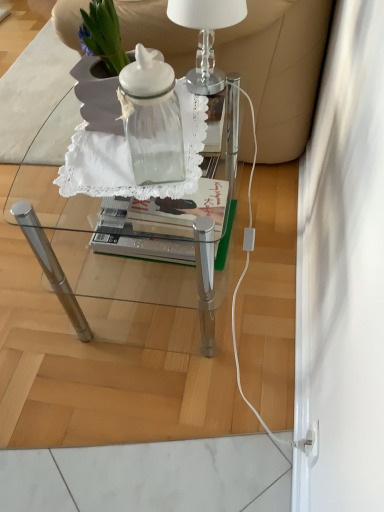
This screenshot has height=512, width=384. In order to click on white leather armchair at upper center in this screenshot , I will do `click(278, 69)`.

Identify the location of transparent glass table at center. pos(133,242).

What do you see at coordinates (133, 242) in the screenshot? The height and width of the screenshot is (512, 384). I see `transparent glass table at center` at bounding box center [133, 242].

The height and width of the screenshot is (512, 384). I want to click on transparent glass jar at center, so click(152, 120).

Find the location of a particular element. This screenshot has width=384, height=512. white leather armchair at upper center is located at coordinates (278, 69).

Who is taller, clear glass table lamp at upper center or transparent glass table at center?

transparent glass table at center is taller.

Is clear glass table lamp at upper center beside transparent glass table at center?

clear glass table lamp at upper center is not next to transparent glass table at center, and they're not touching.

Choose the correct answer: Is clear glass table lamp at upper center inside transparent glass table at center or outside it?

clear glass table lamp at upper center exists outside the volume of transparent glass table at center.

From the image's perspective, is clear glass table lamp at upper center above or below transparent glass table at center?

Based on their image positions, clear glass table lamp at upper center is located above transparent glass table at center.

Is clear glass table lamp at upper center aimed at white leather armchair at upper center?

No, clear glass table lamp at upper center does not turn towards white leather armchair at upper center.

From the image's perspective, is clear glass table lamp at upper center located beneath white leather armchair at upper center?

Yes, from the image's perspective, clear glass table lamp at upper center is beneath white leather armchair at upper center.

Is clear glass table lamp at upper center with white leather armchair at upper center?

No, clear glass table lamp at upper center is not with white leather armchair at upper center.

From a real-world perspective, is clear glass table lamp at upper center under white leather armchair at upper center?

No, from a real-world perspective, clear glass table lamp at upper center is not beneath white leather armchair at upper center.

Is transparent glass jar at center next to transparent glass table at center and touching it?

No.

Looking at this image, from a real-world perspective, is transparent glass jar at center above or below transparent glass table at center?

transparent glass jar at center is situated higher than transparent glass table at center in the real world.

Is transparent glass jar at center inside or outside of transparent glass table at center?

transparent glass jar at center is not inside transparent glass table at center, it's outside.

From the image's perspective, between transparent glass jar at center and clear glass table lamp at upper center, who is located below?

transparent glass jar at center appears lower in the image.

How different are the orientations of transparent glass jar at center and clear glass table lamp at upper center in degrees?

The angle between the facing direction of transparent glass jar at center and the facing direction of clear glass table lamp at upper center is 13.1 degrees.

This screenshot has height=512, width=384. I want to click on bottle that is below the clear glass table lamp at upper center (from the image's perspective), so click(x=152, y=120).

Would you say transparent glass jar at center is a long distance from clear glass table lamp at upper center?

transparent glass jar at center is near clear glass table lamp at upper center, not far away.

Does white leather armchair at upper center appear on the right side of transparent glass jar at center?

No, white leather armchair at upper center is not to the right of transparent glass jar at center.

From the image's perspective, is white leather armchair at upper center on top of transparent glass jar at center?

Yes.

Locate an element on the screen. Image resolution: width=384 pixels, height=512 pixels. armchair above the transparent glass jar at center (from the image's perspective) is located at coordinates (278, 69).

From a real-world perspective, is white leather armchair at upper center under transparent glass jar at center?

Indeed, from a real-world perspective, white leather armchair at upper center is positioned beneath transparent glass jar at center.

Identify the location of table in front of the clear glass table lamp at upper center. (133, 242).

How different are the orientations of transparent glass table at center and clear glass table lamp at upper center in degrees?

The angle between the facing direction of transparent glass table at center and the facing direction of clear glass table lamp at upper center is 0.782 degrees.

From the picture: Does transparent glass table at center turn towards clear glass table lamp at upper center?

No, transparent glass table at center is not oriented towards clear glass table lamp at upper center.

From a real-world perspective, is transparent glass table at center positioned above or below clear glass table lamp at upper center?

transparent glass table at center is situated lower than clear glass table lamp at upper center in the real world.

Is white leather armchair at upper center next to clear glass table lamp at upper center?

No, white leather armchair at upper center is not next to clear glass table lamp at upper center.

Is white leather armchair at upper center bigger or smaller than clear glass table lamp at upper center?

In the image, white leather armchair at upper center appears to be larger than clear glass table lamp at upper center.

Could you tell me if white leather armchair at upper center is turned towards clear glass table lamp at upper center?

No, white leather armchair at upper center does not turn towards clear glass table lamp at upper center.

From the image's perspective, is white leather armchair at upper center positioned above or below clear glass table lamp at upper center?

white leather armchair at upper center is situated higher than clear glass table lamp at upper center in the image.

Where is `table below the clear glass table lamp at upper center (from the image's perspective)`? Image resolution: width=384 pixels, height=512 pixels. table below the clear glass table lamp at upper center (from the image's perspective) is located at coordinates (133, 242).

This screenshot has height=512, width=384. Identify the location of table lamp on the right side of white leather armchair at upper center. (206, 37).

Estimate the real-world distances between objects in this image. Which object is further from transparent glass table at center, clear glass table lamp at upper center or white leather armchair at upper center?

Based on the image, white leather armchair at upper center appears to be further to transparent glass table at center.

Which object lies nearer to the anchor point white leather armchair at upper center, transparent glass table at center or transparent glass jar at center?

Among the two, transparent glass jar at center is located nearer to white leather armchair at upper center.

Considering their positions, is clear glass table lamp at upper center positioned further to transparent glass jar at center than white leather armchair at upper center?

white leather armchair at upper center lies further to transparent glass jar at center than the other object.

Estimate the real-world distances between objects in this image. Which object is further from clear glass table lamp at upper center, white leather armchair at upper center or transparent glass table at center?

transparent glass table at center is positioned further to the anchor clear glass table lamp at upper center.

Looking at the image, which one is located further to transparent glass table at center, white leather armchair at upper center or clear glass table lamp at upper center?

white leather armchair at upper center is further to transparent glass table at center.

From the image, which object appears to be nearer to clear glass table lamp at upper center, transparent glass table at center or white leather armchair at upper center?

white leather armchair at upper center is closer to clear glass table lamp at upper center.

Considering their positions, is clear glass table lamp at upper center positioned closer to transparent glass jar at center than transparent glass table at center?

clear glass table lamp at upper center is closer to transparent glass jar at center.

From the image, which object appears to be farther from white leather armchair at upper center, clear glass table lamp at upper center or transparent glass table at center?

Among the two, transparent glass table at center is located further to white leather armchair at upper center.

What are the coordinates of `bottle between clear glass table lamp at upper center and transparent glass table at center in the vertical direction` in the screenshot? It's located at (152, 120).

Image resolution: width=384 pixels, height=512 pixels. Identify the location of table lamp between white leather armchair at upper center and transparent glass jar at center from top to bottom. (206, 37).

Image resolution: width=384 pixels, height=512 pixels. Find the location of `table lamp between white leather armchair at upper center and transparent glass table at center in the vertical direction`. table lamp between white leather armchair at upper center and transparent glass table at center in the vertical direction is located at coordinates (206, 37).

Locate an element on the screen. This screenshot has width=384, height=512. bottle between white leather armchair at upper center and transparent glass table at center vertically is located at coordinates (152, 120).